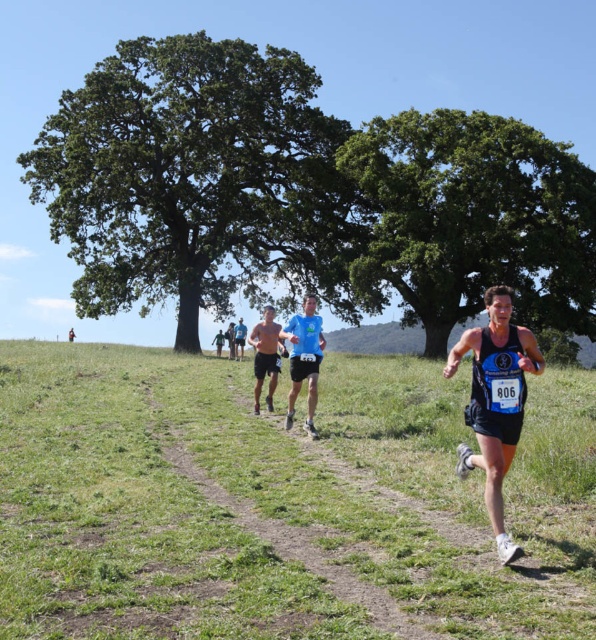
Question: Which object is closer to the camera taking this photo?

Choices:
 (A) light brown skin at center
 (B) blue fabric shirt at center

Answer: (B)

Question: Which object appears closest to the camera in this image?

Choices:
 (A) blue fabric shirt at center
 (B) green grass at center

Answer: (B)

Question: Is green leafy tree at upper left to the right of light brown skin at center from the viewer's perspective?

Choices:
 (A) no
 (B) yes

Answer: (A)

Question: Is green grass at center to the right of matte skin running at center from the viewer's perspective?

Choices:
 (A) no
 (B) yes

Answer: (B)

Question: Does green leafy tree at center appear over matte skin running at center?

Choices:
 (A) no
 (B) yes

Answer: (B)

Question: Which point is closer to the camera?

Choices:
 (A) green grass at center
 (B) light brown skin at center
 (C) matte skin running at center
 (D) green leafy tree at center

Answer: (A)